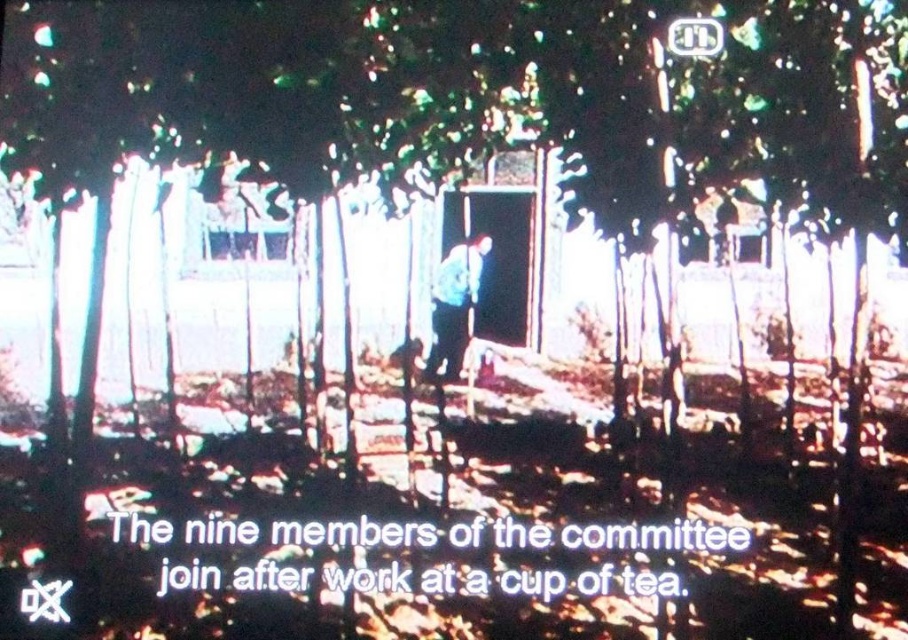
You are standing at the entrance of the gazebo and want to place a metallic rectangular object that is 10 feet long on the ground between the blue denim jacket at center and the metallic rectangular at upper center. Is there enough space?

The blue denim jacket at center is 9.38 feet from the metallic rectangular at upper center. Since the metallic rectangular object to be placed is 10 feet long, the distance between them is insufficient. Therefore, there isn not enough space.

You are looking at the image of the garden gazebo. There is a point marked at coordinates [454,305]. Which object in the scene does this point correspond to?

The point at coordinates [454,305] corresponds to the blue denim jacket at center.